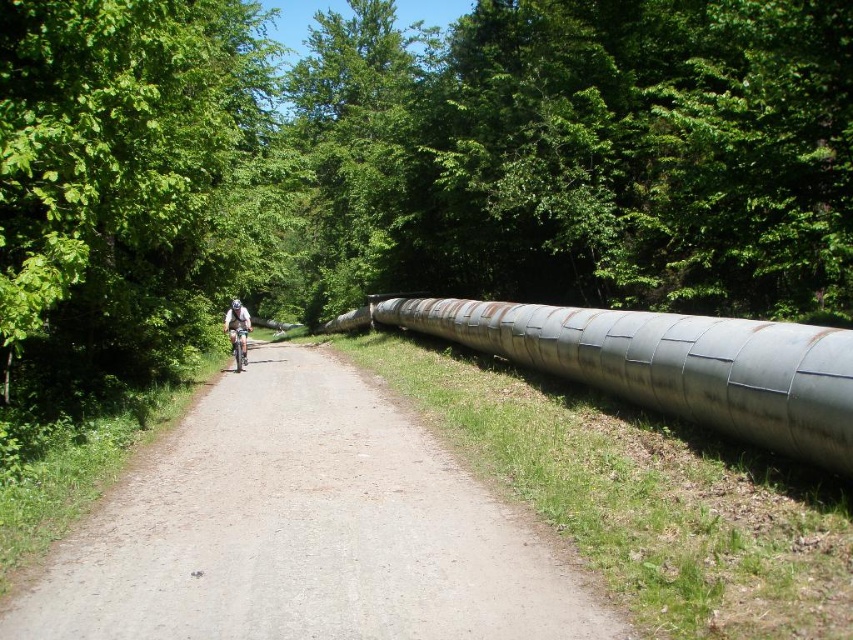
You are planning to ride a bike along the path and have two helmets to choose from. The light blue fabric helmet at center and the white matte bicycle helmet at center. Which helmet should you choose to ensure it fits properly under your cycling cap?

The white matte bicycle helmet at center is the appropriate choice for cycling because it is designed to fit securely under a cycling cap, whereas the light blue fabric helmet at center might be wider and could interfere with the cap.

You are a hiker planning to walk along the path in the forest. You have two helmets, a light blue fabric helmet at center and a white matte bicycle helmet at center. You want to place them on the path so they are as close as possible to each other but not overlapping. What is the minimum distance you should keep between them?

The minimum distance you should keep between the light blue fabric helmet at center and the white matte bicycle helmet at center is 25.54 inches to ensure they are as close as possible without overlapping.

You are a hiker planning to wear both the light blue fabric helmet at center and the white matte bicycle helmet at center during your forest trail walk. Which helmet should you choose to ensure it doesn not interfere with your vision while walking on the path?

You should choose the white matte bicycle helmet at center because it is smaller than the light blue fabric helmet at center, which would provide better visibility while walking on the path.